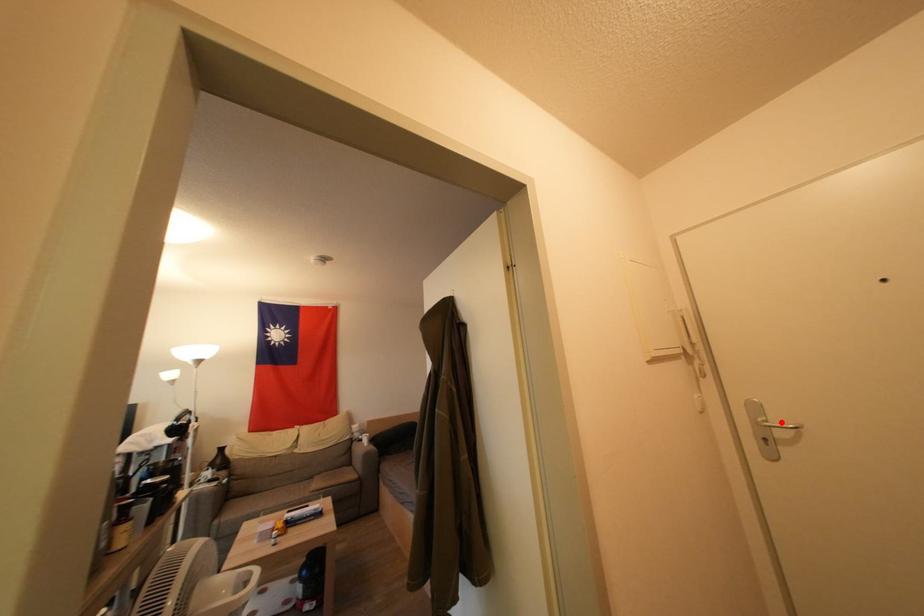
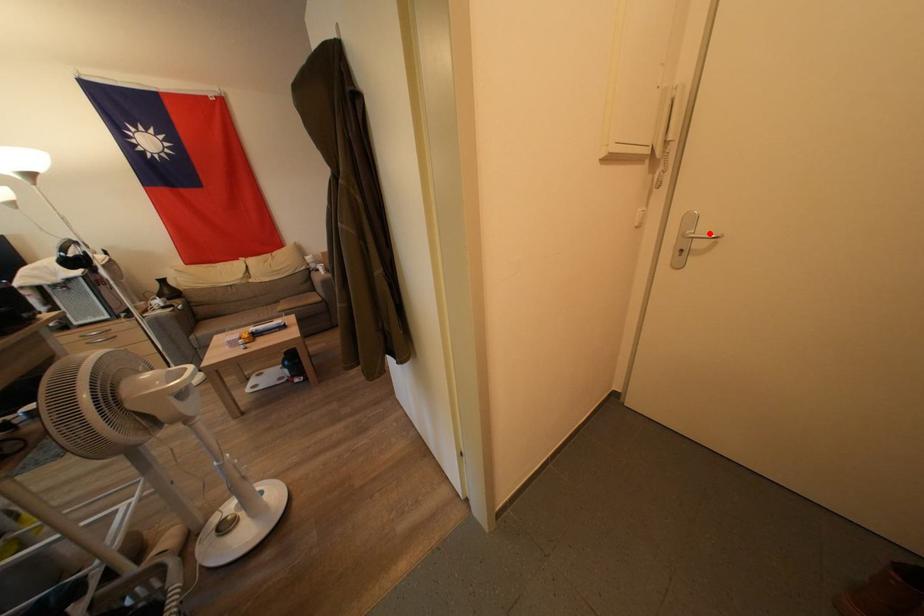
I am providing you with two images of the same scene from different viewpoints. A red point is marked on the first image and another point is marked on the second image. Are the points marked in image1 and image2 representing the same 3D position?

Yes